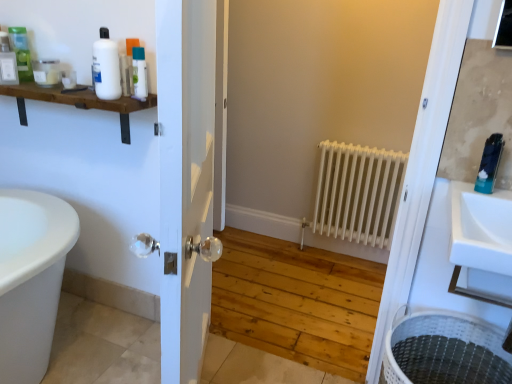
Where is `free space in front of white matte radiator at center`? free space in front of white matte radiator at center is located at coordinates point(339,286).